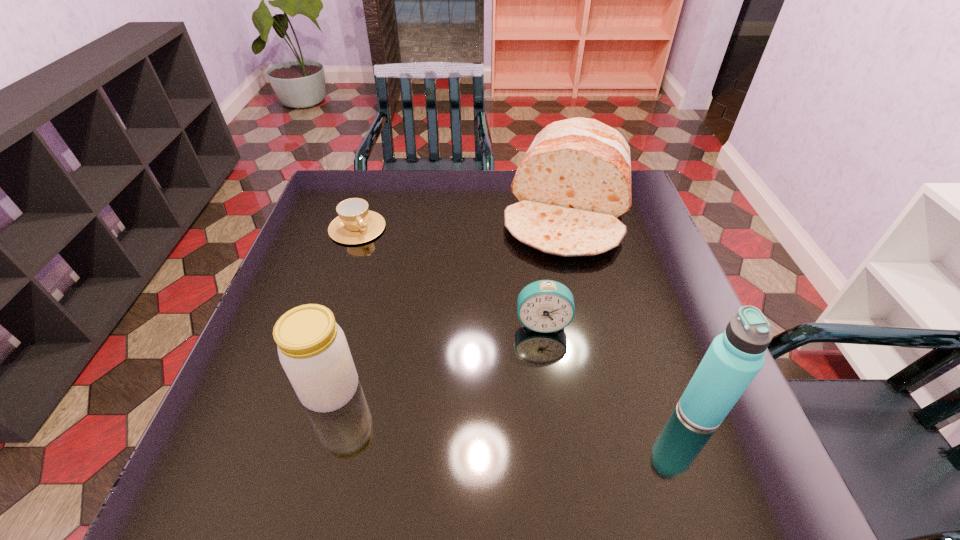
In order to click on thermos bottle at the near edge in this screenshot , I will do `click(734, 358)`.

The image size is (960, 540). I want to click on jar positioned at the left edge, so click(313, 351).

The width and height of the screenshot is (960, 540). In order to click on cup that is at the left edge in this screenshot , I will do `click(355, 224)`.

Where is `thermos bottle that is positioned at the right edge`? The image size is (960, 540). thermos bottle that is positioned at the right edge is located at coordinates (734, 358).

At what (x,y) coordinates should I click in order to perform the action: click on bread present at the right edge. Please return your answer as a coordinate pair (x, y). Looking at the image, I should click on (574, 182).

At what (x,y) coordinates should I click in order to perform the action: click on object that is at the far left corner. Please return your answer as a coordinate pair (x, y). Image resolution: width=960 pixels, height=540 pixels. Looking at the image, I should click on (355, 224).

You are a GUI agent. You are given a task and a screenshot of the screen. Output one action in this format:
    pyautogui.click(x=<x>, y=<y>)
    Task: Click on the object that is at the near left corner
    
    Given the screenshot: What is the action you would take?
    pyautogui.click(x=313, y=351)

Identify the location of object situated at the far right corner. (574, 182).

Where is `object situated at the near right corner`? object situated at the near right corner is located at coordinates (734, 358).

What are the coordinates of `free point at the far edge` in the screenshot? It's located at (415, 195).